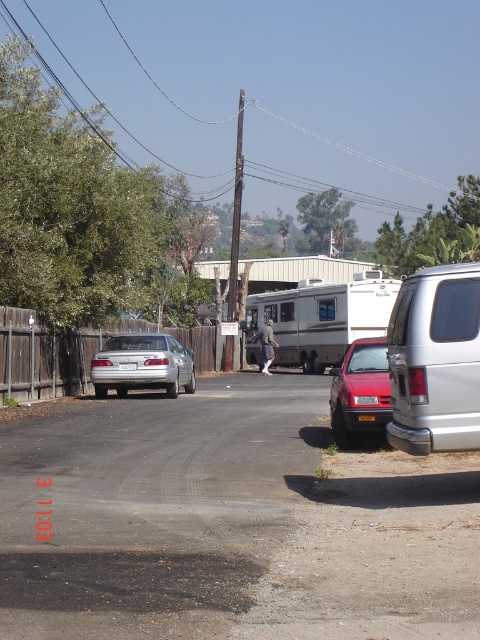
Question: Can you confirm if metallic red car at right is positioned above white plastic license plate at center?

Choices:
 (A) no
 (B) yes

Answer: (A)

Question: Which of these objects is positioned farthest from the silver metallic van at right?

Choices:
 (A) satin silver sedan at center
 (B) silver metallic camper at center
 (C) metallic red car at right

Answer: (B)

Question: Does silver metallic camper at center appear over yellow matte license plate at center?

Choices:
 (A) no
 (B) yes

Answer: (B)

Question: Estimate the real-world distances between objects in this image. Which object is farther from the metallic red car at right?

Choices:
 (A) satin silver sedan at center
 (B) silver metallic camper at center
 (C) silver metallic van at right

Answer: (A)

Question: Which of the following is the closest to the observer?

Choices:
 (A) white plastic license plate at center
 (B) metallic red car at right

Answer: (B)

Question: Is silver metallic camper at center positioned in front of white plastic license plate at center?

Choices:
 (A) no
 (B) yes

Answer: (A)